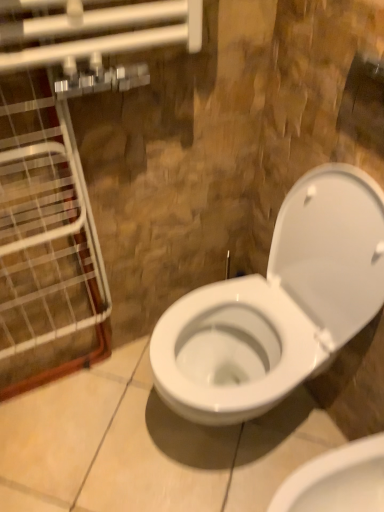
Find the location of `white glossy toilet at center, which is the first toilet from top to bottom`. white glossy toilet at center, which is the first toilet from top to bottom is located at coordinates (278, 305).

What is the approximate height of white glossy toilet at center, acting as the second toilet starting from the top?

white glossy toilet at center, acting as the second toilet starting from the top, is 15.48 inches in height.

What is the approximate width of white glossy toilet at center, the first toilet ordered from the bottom?

It is 20.43 inches.

The height and width of the screenshot is (512, 384). In order to click on white glossy toilet at center, the second toilet from the bottom in this screenshot , I will do click(278, 305).

Between clear glass door at left and white glossy toilet at center, which is the first toilet from top to bottom, which one has less height?

white glossy toilet at center, which is the first toilet from top to bottom.

Between clear glass door at left and white glossy toilet at center, the second toilet from the bottom, which one appears on the left side from the viewer's perspective?

From the viewer's perspective, clear glass door at left appears more on the left side.

Measure the distance between clear glass door at left and white glossy toilet at center, the second toilet from the bottom.

A distance of 18.90 inches exists between clear glass door at left and white glossy toilet at center, the second toilet from the bottom.

From a real-world perspective, does clear glass door at left stand above white glossy toilet at center, which is the first toilet from top to bottom?

Correct, in the physical world, clear glass door at left is higher than white glossy toilet at center, which is the first toilet from top to bottom.

Looking at their sizes, would you say white glossy toilet at center, acting as the second toilet starting from the top, is wider or thinner than clear glass door at left?

In the image, white glossy toilet at center, acting as the second toilet starting from the top, appears to be wider than clear glass door at left.

I want to click on glass door above the white glossy toilet at center, acting as the second toilet starting from the top (from the image's perspective), so click(x=46, y=243).

How many degrees apart are the facing directions of white glossy toilet at center, acting as the second toilet starting from the top, and clear glass door at left?

There is a 89.7-degree angle between the facing directions of white glossy toilet at center, acting as the second toilet starting from the top, and clear glass door at left.

In the image, is white glossy toilet at center, the second toilet from the bottom, positioned in front of or behind white glossy toilet at center, acting as the second toilet starting from the top?

In the image, white glossy toilet at center, the second toilet from the bottom, appears in front of white glossy toilet at center, acting as the second toilet starting from the top.

Could you tell me if white glossy toilet at center, which is the first toilet from top to bottom, is facing white glossy toilet at center, the first toilet ordered from the bottom?

No.

Is white glossy toilet at center, which is the first toilet from top to bottom, to the left or to the right of white glossy toilet at center, acting as the second toilet starting from the top, in the image?

From the image, it's evident that white glossy toilet at center, which is the first toilet from top to bottom, is to the left of white glossy toilet at center, acting as the second toilet starting from the top.

From the image's perspective, is white glossy toilet at center, which is the first toilet from top to bottom, above or below white glossy toilet at center, acting as the second toilet starting from the top?

white glossy toilet at center, which is the first toilet from top to bottom, is situated higher than white glossy toilet at center, acting as the second toilet starting from the top, in the image.

Image resolution: width=384 pixels, height=512 pixels. I want to click on glass door in front of the white glossy toilet at center, the first toilet ordered from the bottom, so click(x=46, y=243).

Is clear glass door at left wider than white glossy toilet at center, the first toilet ordered from the bottom?

In fact, clear glass door at left might be narrower than white glossy toilet at center, the first toilet ordered from the bottom.

From the image's perspective, does clear glass door at left appear lower than white glossy toilet at center, acting as the second toilet starting from the top?

No, from the image's perspective, clear glass door at left is not below white glossy toilet at center, acting as the second toilet starting from the top.

Could you tell me if white glossy toilet at center, which is the first toilet from top to bottom, is turned towards clear glass door at left?

No.

Considering the points (324, 259) and (18, 139), which point is in front, point (324, 259) or point (18, 139)?

Positioned in front is point (18, 139).

From a real-world perspective, is white glossy toilet at center, the second toilet from the bottom, above or below clear glass door at left?

white glossy toilet at center, the second toilet from the bottom, is situated lower than clear glass door at left in the real world.

How different are the orientations of white glossy toilet at center, the second toilet from the bottom, and clear glass door at left in degrees?

They differ by 89.7 degrees in their facing directions.

Which is nearer, (302,472) or (252,359)?

The point (302,472) is in front.

Who is bigger, white glossy toilet at center, the first toilet ordered from the bottom, or white glossy toilet at center, which is the first toilet from top to bottom?

With larger size is white glossy toilet at center, which is the first toilet from top to bottom.

Considering the sizes of objects white glossy toilet at center, acting as the second toilet starting from the top, and white glossy toilet at center, which is the first toilet from top to bottom, in the image provided, who is thinner, white glossy toilet at center, acting as the second toilet starting from the top, or white glossy toilet at center, which is the first toilet from top to bottom,?

white glossy toilet at center, acting as the second toilet starting from the top.

In the scene shown: Considering the positions of objects white glossy toilet at center, acting as the second toilet starting from the top, and white glossy toilet at center, which is the first toilet from top to bottom, in the image provided, who is more to the left, white glossy toilet at center, acting as the second toilet starting from the top, or white glossy toilet at center, which is the first toilet from top to bottom,?

Positioned to the left is white glossy toilet at center, which is the first toilet from top to bottom.

Image resolution: width=384 pixels, height=512 pixels. I want to click on glass door on the left of white glossy toilet at center, which is the first toilet from top to bottom, so click(x=46, y=243).

Starting from the clear glass door at left, which toilet is the 2nd one behind? Please provide its 2D coordinates.

[(337, 480)]

Based on their spatial positions, is white glossy toilet at center, the first toilet ordered from the bottom, or clear glass door at left closer to white glossy toilet at center, which is the first toilet from top to bottom?

white glossy toilet at center, the first toilet ordered from the bottom, is closer to white glossy toilet at center, which is the first toilet from top to bottom.

From the image, which object appears to be farther from clear glass door at left, white glossy toilet at center, which is the first toilet from top to bottom, or white glossy toilet at center, the first toilet ordered from the bottom?

white glossy toilet at center, the first toilet ordered from the bottom.

Which object lies further to the anchor point white glossy toilet at center, the second toilet from the bottom, clear glass door at left or white glossy toilet at center, acting as the second toilet starting from the top?

Based on the image, clear glass door at left appears to be further to white glossy toilet at center, the second toilet from the bottom.

From the image, which object appears to be nearer to clear glass door at left, white glossy toilet at center, the first toilet ordered from the bottom, or white glossy toilet at center, which is the first toilet from top to bottom?

white glossy toilet at center, which is the first toilet from top to bottom.

Considering their positions, is clear glass door at left positioned closer to white glossy toilet at center, the first toilet ordered from the bottom, than white glossy toilet at center, which is the first toilet from top to bottom?

white glossy toilet at center, which is the first toilet from top to bottom, is positioned closer to the anchor white glossy toilet at center, the first toilet ordered from the bottom.

Looking at the image, which one is located further to white glossy toilet at center, the first toilet ordered from the bottom, white glossy toilet at center, the second toilet from the bottom, or clear glass door at left?

Based on the image, clear glass door at left appears to be further to white glossy toilet at center, the first toilet ordered from the bottom.

The width and height of the screenshot is (384, 512). I want to click on toilet between clear glass door at left and white glossy toilet at center, acting as the second toilet starting from the top, so click(278, 305).